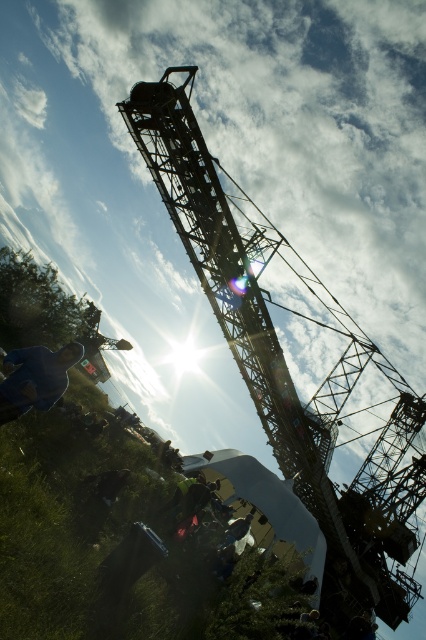
You are a GUI agent. You are given a task and a screenshot of the screen. Output one action in this format:
    pyautogui.click(x=<x>, y=<y>)
    Task: Click on the metallic structure at center
    
    Given the screenshot: What is the action you would take?
    pyautogui.click(x=296, y=362)

Who is lower down, metallic structure at center or blue fabric jacket at lower left?

metallic structure at center is lower down.

Is point (400, 532) more distant than point (43, 394)?

That is True.

At what (x,y) coordinates should I click in order to perform the action: click on metallic structure at center. Please return your answer as a coordinate pair (x, y). The height and width of the screenshot is (640, 426). Looking at the image, I should click on (296, 362).